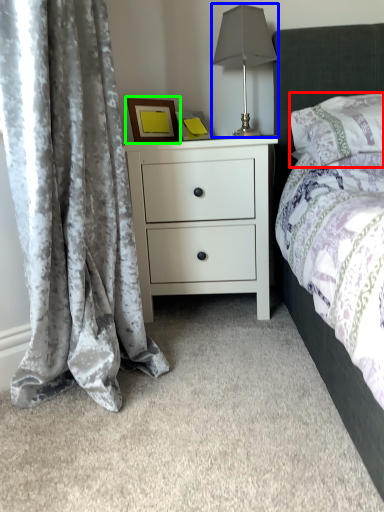
Question: Based on their relative distances, which object is farther from pillow (highlighted by a red box)? Choose from table lamp (highlighted by a blue box) and picture frame (highlighted by a green box).

Choices:
 (A) table lamp
 (B) picture frame

Answer: (B)